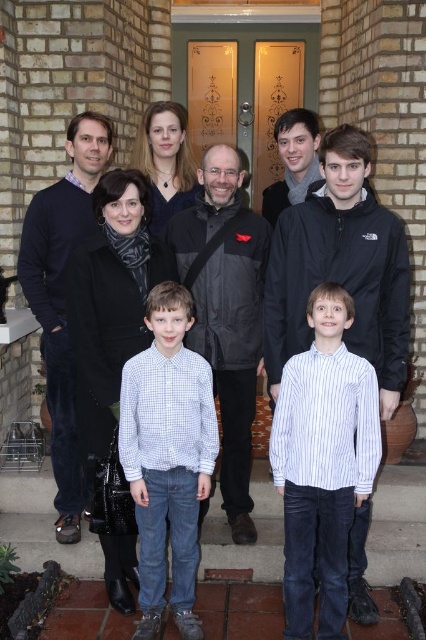
You are standing at the bottom of the steps leading to the door. You need to hand a note to the person wearing the white checkered shirt at center. Based on their position, which direction should you move to reach them?

The white checkered shirt at center is located at point (167, 456), so you should move forward up the steps towards the center to reach them.

Based on the photo, you are standing at the bottom of the steps leading to the door. You want to take a photo of the white checkered shirt at center without moving closer. Is the distance sufficient for a clear photo?

The white checkered shirt at center is 9.58 feet away from camera, so yes, the distance is sufficient for a clear photo as it is within a reasonable range for most cameras to capture details clearly.